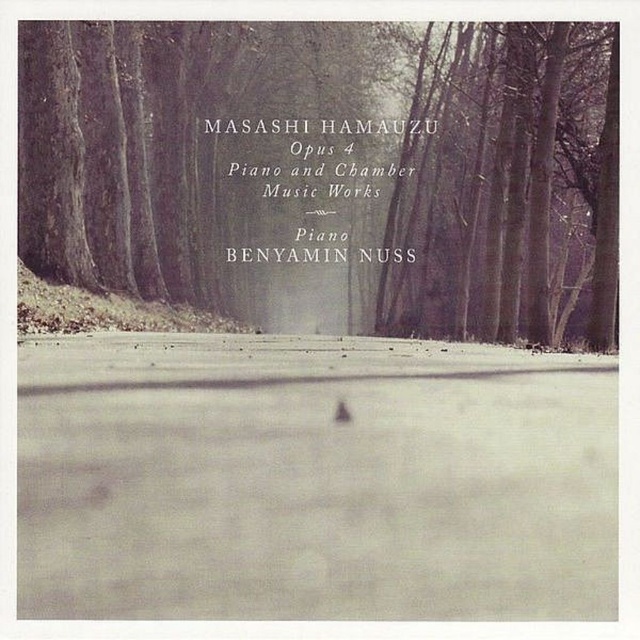
Question: Does smooth bark tree at center appear on the right side of smooth bark tree at upper right?

Choices:
 (A) yes
 (B) no

Answer: (A)

Question: From the image, what is the correct spatial relationship of smooth bark tree at center in relation to smooth bark tree at upper right?

Choices:
 (A) right
 (B) left

Answer: (A)

Question: Can you confirm if smooth bark tree at center is smaller than smooth bark tree at upper right?

Choices:
 (A) no
 (B) yes

Answer: (B)

Question: Which object appears farthest from the camera in this image?

Choices:
 (A) smooth bark tree at center
 (B) smooth bark tree at upper right

Answer: (B)

Question: Which point appears farthest from the camera in this image?

Choices:
 (A) (456, 228)
 (B) (481, 320)

Answer: (A)